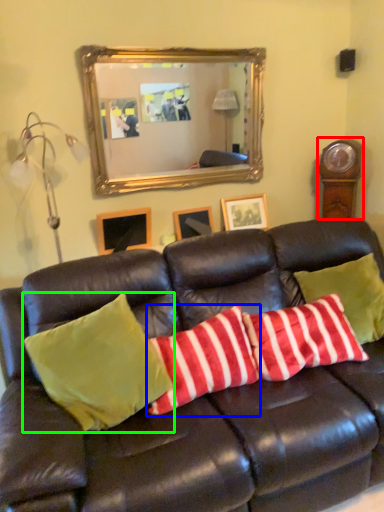
Question: Which is nearer to the clock (highlighted by a red box)? pillow (highlighted by a blue box) or pillow (highlighted by a green box).

Choices:
 (A) pillow
 (B) pillow

Answer: (A)